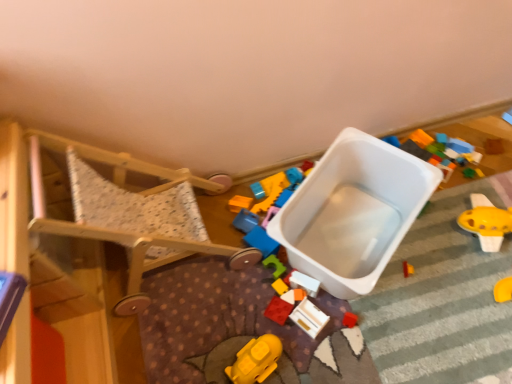
Where is `free space between yellow plastic toy at right, placed as the 6th toy when sorted from left to right, and wooden toy at center, the second toy in the right-to-left sequence`? free space between yellow plastic toy at right, placed as the 6th toy when sorted from left to right, and wooden toy at center, the second toy in the right-to-left sequence is located at coordinates (412, 273).